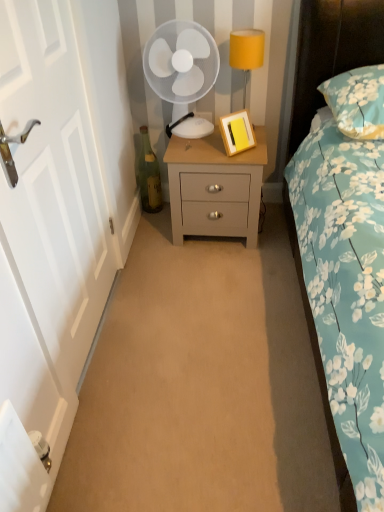
Question: Is light gray wood nightstand at center further to the viewer compared to white plastic fan at upper center?

Choices:
 (A) no
 (B) yes

Answer: (B)

Question: Can you confirm if light gray wood nightstand at center is bigger than white plastic fan at upper center?

Choices:
 (A) yes
 (B) no

Answer: (A)

Question: Considering the relative sizes of light gray wood nightstand at center and white plastic fan at upper center in the image provided, is light gray wood nightstand at center taller than white plastic fan at upper center?

Choices:
 (A) yes
 (B) no

Answer: (B)

Question: From the image's perspective, is light gray wood nightstand at center on top of white plastic fan at upper center?

Choices:
 (A) no
 (B) yes

Answer: (A)

Question: Is light gray wood nightstand at center far away from white plastic fan at upper center?

Choices:
 (A) yes
 (B) no

Answer: (B)

Question: Considering the positions of light gray wood nightstand at center and floral fabric pillow at upper right in the image, is light gray wood nightstand at center wider or thinner than floral fabric pillow at upper right?

Choices:
 (A) thin
 (B) wide

Answer: (A)

Question: From the image's perspective, is light gray wood nightstand at center located above or below floral fabric pillow at upper right?

Choices:
 (A) above
 (B) below

Answer: (B)

Question: Based on their positions, is light gray wood nightstand at center located to the left or right of floral fabric pillow at upper right?

Choices:
 (A) left
 (B) right

Answer: (A)

Question: Is light gray wood nightstand at center taller or shorter than floral fabric pillow at upper right?

Choices:
 (A) tall
 (B) short

Answer: (A)

Question: Considering the positions of light gray wood nightstand at center and green glass bottle at lower left in the image, is light gray wood nightstand at center taller or shorter than green glass bottle at lower left?

Choices:
 (A) tall
 (B) short

Answer: (A)

Question: In the image, is light gray wood nightstand at center on the left side or the right side of green glass bottle at lower left?

Choices:
 (A) left
 (B) right

Answer: (B)

Question: Is light gray wood nightstand at center inside the boundaries of green glass bottle at lower left, or outside?

Choices:
 (A) inside
 (B) outside

Answer: (B)

Question: Considering their positions, is light gray wood nightstand at center located in front of or behind green glass bottle at lower left?

Choices:
 (A) front
 (B) behind

Answer: (A)

Question: Is white plastic fan at upper center inside or outside of floral fabric pillow at upper right?

Choices:
 (A) inside
 (B) outside

Answer: (B)

Question: Considering the positions of point (190, 130) and point (370, 135), is point (190, 130) closer or farther from the camera than point (370, 135)?

Choices:
 (A) closer
 (B) farther

Answer: (B)